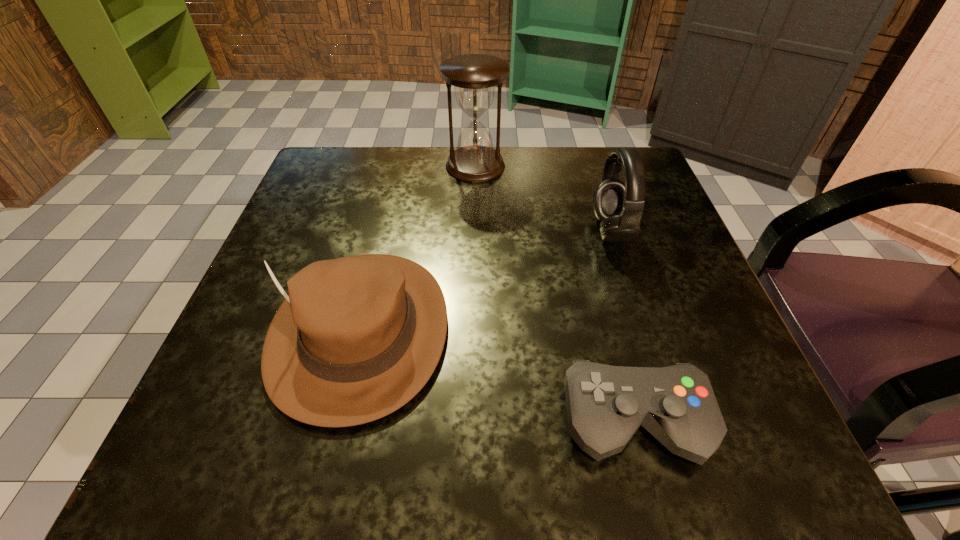
Where is `vacant area situated on the left of the control`? vacant area situated on the left of the control is located at coordinates (416, 421).

You are a GUI agent. You are given a task and a screenshot of the screen. Output one action in this format:
    pyautogui.click(x=<x>, y=<y>)
    Task: Click on the hourglass located at the far edge
    The height and width of the screenshot is (540, 960).
    Given the screenshot: What is the action you would take?
    pyautogui.click(x=474, y=76)

You are a GUI agent. You are given a task and a screenshot of the screen. Output one action in this format:
    pyautogui.click(x=<x>, y=<y>)
    Task: Click on the headset that is at the far edge
    The width and height of the screenshot is (960, 540).
    Given the screenshot: What is the action you would take?
    pyautogui.click(x=619, y=206)

Locate an element on the screen. Image resolution: width=960 pixels, height=540 pixels. fedora located in the near edge section of the desktop is located at coordinates (356, 338).

The image size is (960, 540). Find the location of `control that is at the near edge`. control that is at the near edge is located at coordinates (606, 405).

I want to click on object that is at the left edge, so click(356, 338).

I want to click on headset positioned at the right edge, so click(619, 206).

What are the coordinates of `control that is at the right edge` in the screenshot? It's located at (606, 405).

Locate an element on the screen. Image resolution: width=960 pixels, height=540 pixels. object present at the near left corner is located at coordinates (356, 338).

Find the location of `object situated at the far right corner`. object situated at the far right corner is located at coordinates (619, 206).